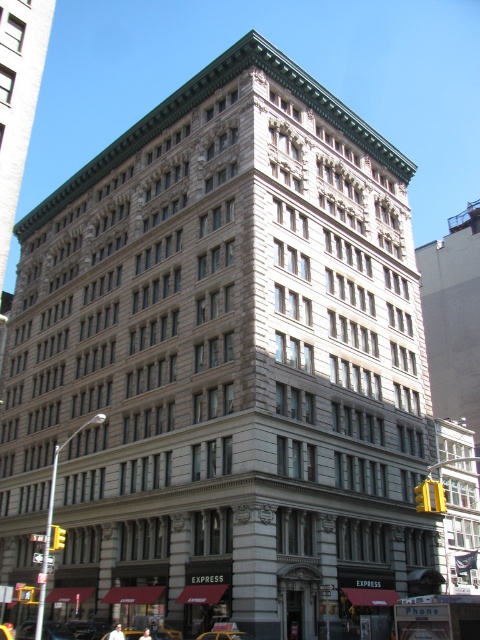
Is yellow rubber taxi at lower center closer to the viewer compared to yellow rubber taxi at center?

No, yellow rubber taxi at lower center is behind yellow rubber taxi at center.

Measure the distance between point (210, 634) and camera.

The distance of point (210, 634) from camera is 129.90 feet.

The image size is (480, 640). Find the location of `yellow rubber taxi at lower center`. yellow rubber taxi at lower center is located at coordinates tap(225, 634).

Does point (139, 632) come closer to viewer compared to point (217, 637)?

That is False.

Describe the element at coordinates (166, 634) in the screenshot. I see `yellow metallic taxi cab at lower center` at that location.

Does point (156, 634) come behind point (232, 637)?

Yes, point (156, 634) is behind point (232, 637).

You are a GUI agent. You are given a task and a screenshot of the screen. Output one action in this format:
    pyautogui.click(x=<x>, y=<y>)
    Task: Click on the yellow metallic taxi cab at lower center
    The height and width of the screenshot is (640, 480).
    Given the screenshot: What is the action you would take?
    pyautogui.click(x=166, y=634)

Which of these two, metallic silver car at lower left or yellow rubber taxi at lower center, stands shorter?

yellow rubber taxi at lower center is shorter.

What are the coordinates of `metallic silver car at lower left` in the screenshot? It's located at (56, 632).

Find the location of a particular element. metallic silver car at lower left is located at coordinates (56, 632).